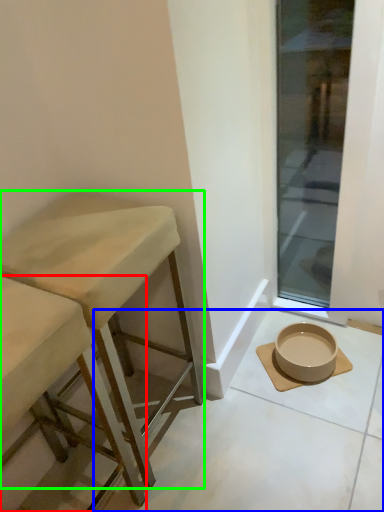
Question: Which is farther away from stool (highlighted by a red box)? concrete (highlighted by a blue box) or stool (highlighted by a green box)?

Choices:
 (A) concrete
 (B) stool

Answer: (A)